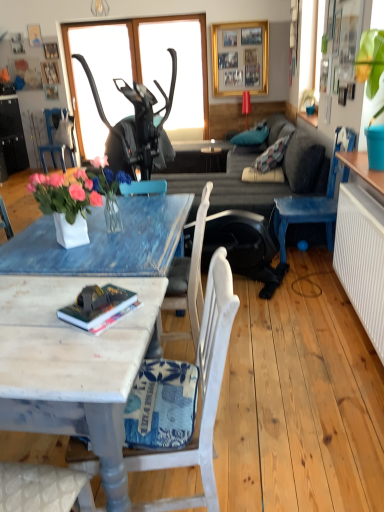
Where is `vacant area on top of wooden marble coffee table at lower left (from a real-world perspective)`? The height and width of the screenshot is (512, 384). vacant area on top of wooden marble coffee table at lower left (from a real-world perspective) is located at coordinates (51, 317).